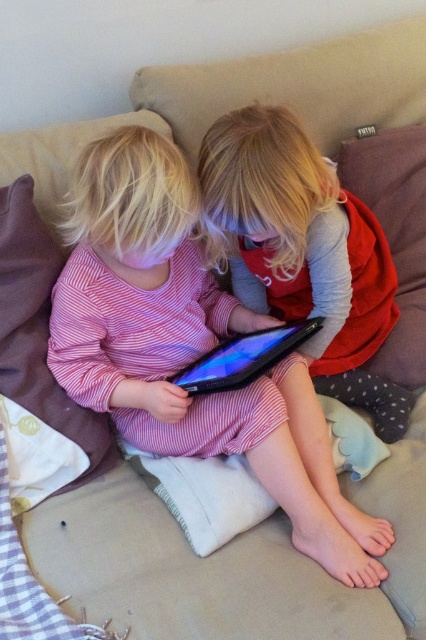
Question: Which of the following is the closest to the observer?

Choices:
 (A) pink striped dress at center
 (B) matte black tablet at center

Answer: (A)

Question: Considering the real-world distances, which object is farthest from the black matte tablet at center?

Choices:
 (A) matte black tablet at center
 (B) pink striped dress at center

Answer: (A)

Question: Where is pink striped dress at center located in relation to matte black tablet at center in the image?

Choices:
 (A) above
 (B) below

Answer: (B)

Question: Does pink striped dress at center have a larger size compared to matte black tablet at center?

Choices:
 (A) no
 (B) yes

Answer: (B)

Question: Is pink striped dress at center thinner than black matte tablet at center?

Choices:
 (A) yes
 (B) no

Answer: (B)

Question: Which point is closer to the camera taking this photo?

Choices:
 (A) (137, 243)
 (B) (238, 353)
 (C) (351, 221)

Answer: (A)